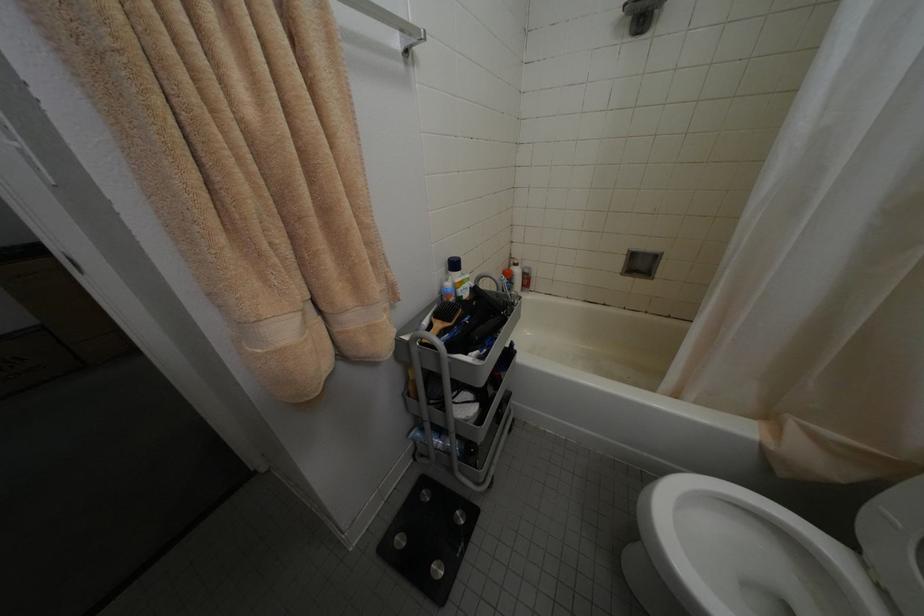
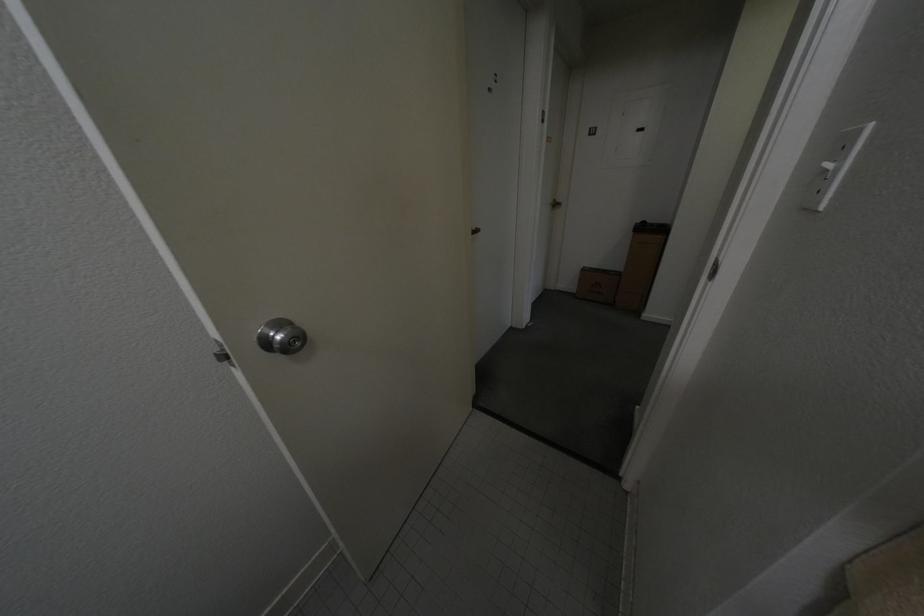
First-person continuous shooting, in which direction is the camera rotating?

The camera rotated toward left-down.